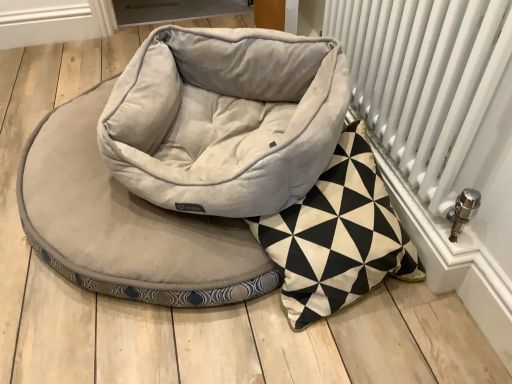
Question: Does point (53, 233) appear closer or farther from the camera than point (370, 61)?

Choices:
 (A) closer
 (B) farther

Answer: (A)

Question: Is suede-like beige dog bed at center inside the boundaries of white metal radiator at right, or outside?

Choices:
 (A) inside
 (B) outside

Answer: (B)

Question: Considering the positions of suede-like beige dog bed at center and white metal radiator at right in the image, is suede-like beige dog bed at center wider or thinner than white metal radiator at right?

Choices:
 (A) wide
 (B) thin

Answer: (A)

Question: Based on their sizes in the image, would you say white metal radiator at right is bigger or smaller than suede-like beige dog bed at center?

Choices:
 (A) big
 (B) small

Answer: (B)

Question: Considering their positions, is white metal radiator at right located in front of or behind suede-like beige dog bed at center?

Choices:
 (A) front
 (B) behind

Answer: (A)

Question: Considering the relative positions of white metal radiator at right and suede-like beige dog bed at center in the image provided, is white metal radiator at right to the left or to the right of suede-like beige dog bed at center?

Choices:
 (A) left
 (B) right

Answer: (B)

Question: From the image's perspective, is white metal radiator at right located above or below suede-like beige dog bed at center?

Choices:
 (A) above
 (B) below

Answer: (A)